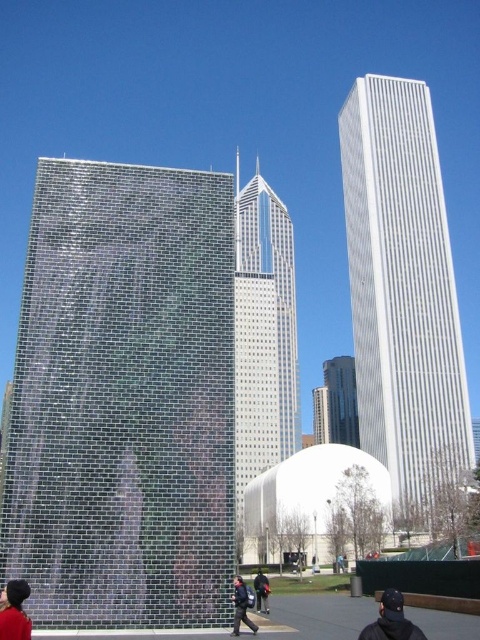
You are a city planner assessing the urban layout. You need to install a new communication tower between the glassy steel skyscraper at center and the dark brown leather jacket at lower left. The tower requires a minimum of 300 feet of space between its base and any existing structures. Can the proposed location between these two objects meet the safety requirement?

The distance between the glassy steel skyscraper at center and the dark brown leather jacket at lower left is 327.20 feet, which exceeds the required 300 feet. Therefore, the proposed location between them can meet the safety requirement for the communication tower.

Looking at this image, you are an architect observing the urban scene. You need to determine which object is taller between the glassy steel skyscraper at center and the dark blue uniform at center. Based on the scene, what can you conclude?

The glassy steel skyscraper at center is much taller than the dark blue uniform at center.

You are a delivery drone that needs to deliver a package to the reflective glass tower at center. You are currently hovering above the black leather jacket at lower center. Can you safely fly directly to the tower without any obstacles between you and the tower?

The reflective glass tower at center and black leather jacket at lower center are 11.87 meters apart from each other. Since there are no objects mentioned between them in the scene description, you can safely fly directly to the tower.